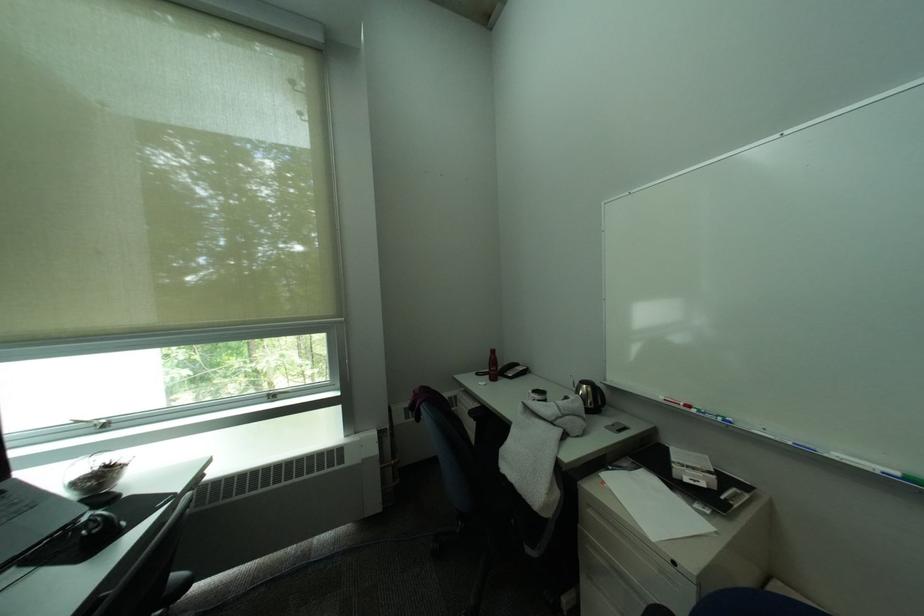
The width and height of the screenshot is (924, 616). I want to click on whiteboard marker, so click(708, 414).